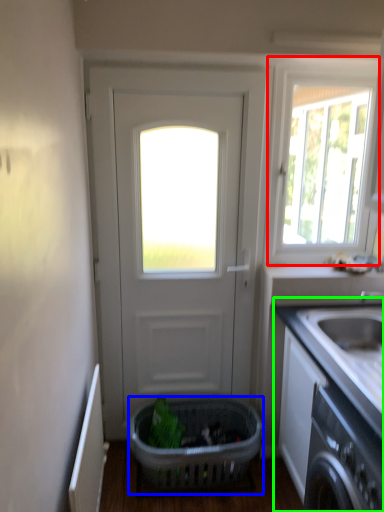
Question: Which object is the farthest from window (highlighted by a red box)? Choose among these: basket (highlighted by a blue box) or countertop (highlighted by a green box).

Choices:
 (A) basket
 (B) countertop

Answer: (A)